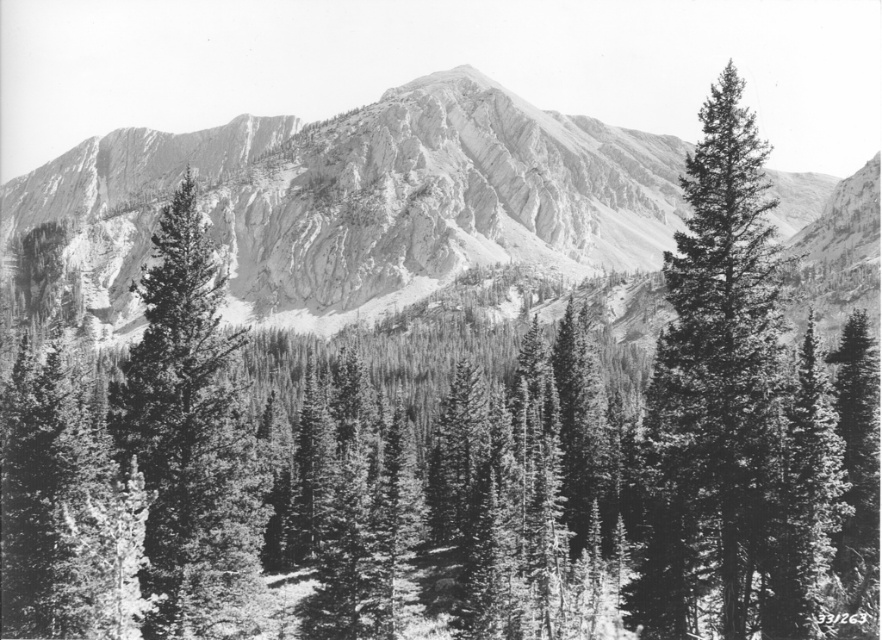
Question: Does smooth green pine tree at center appear on the right side of smooth green pine tree at right?

Choices:
 (A) no
 (B) yes

Answer: (B)

Question: In this image, where is rugged stone mountain range at center located relative to smooth green pine tree at right?

Choices:
 (A) below
 (B) above

Answer: (B)

Question: Which point is closer to the camera?

Choices:
 (A) (198, 621)
 (B) (789, 563)
 (C) (712, 170)
 (D) (278, 202)

Answer: (C)

Question: Which object is the farthest from the smooth green pine tree at center?

Choices:
 (A) smooth green pine tree at right
 (B) smooth bark evergreen at center
 (C) rugged stone mountain range at center

Answer: (C)

Question: Is smooth green pine tree at center wider than smooth green pine tree at right?

Choices:
 (A) yes
 (B) no

Answer: (A)

Question: Which object is closer to the camera taking this photo?

Choices:
 (A) smooth bark evergreen at center
 (B) smooth green pine tree at center
 (C) rugged stone mountain range at center

Answer: (B)